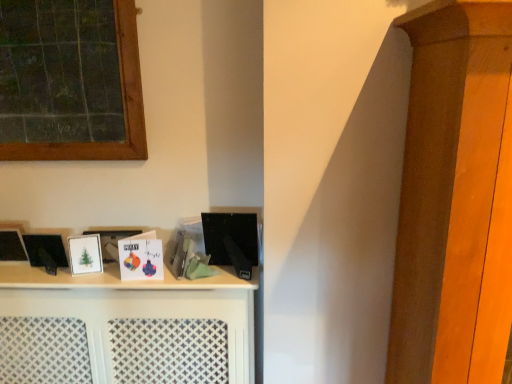
Find the location of a particular element. The image size is (512, 384). unoccupied area in front of matte black book at center, which is the 2th book from left to right is located at coordinates (179, 281).